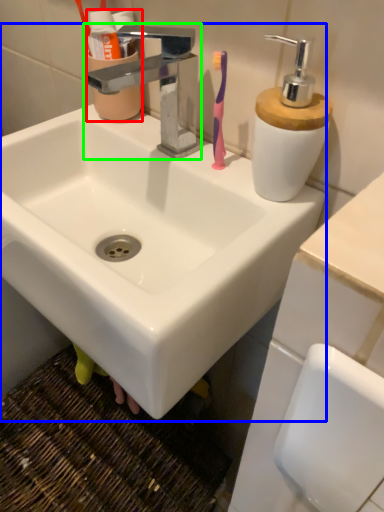
Question: Considering the real-world distances, which object is closest to mouthwash (highlighted by a red box)? sink (highlighted by a blue box) or tap (highlighted by a green box).

Choices:
 (A) sink
 (B) tap

Answer: (B)